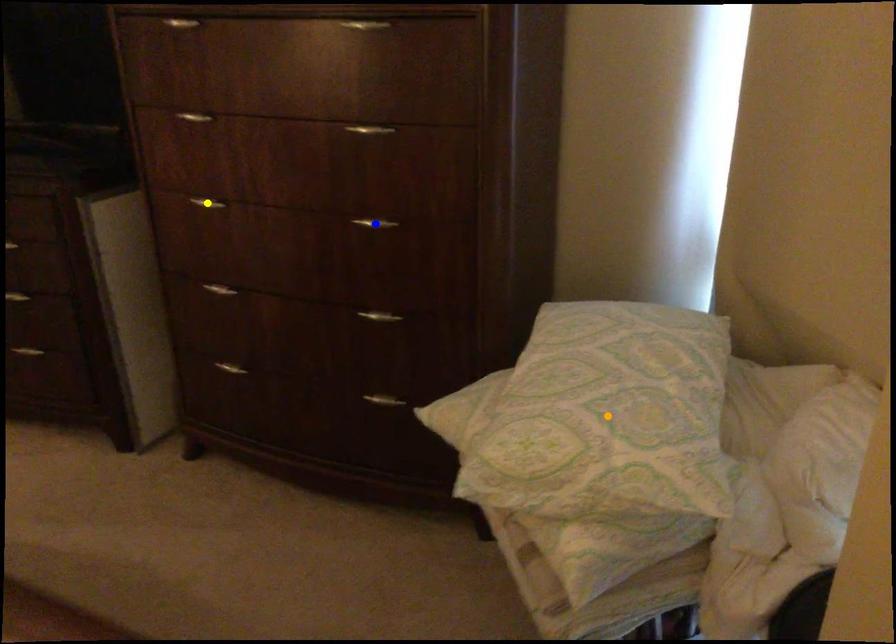
Order these from nearest to farthest:
orange point | blue point | yellow point

orange point
blue point
yellow point